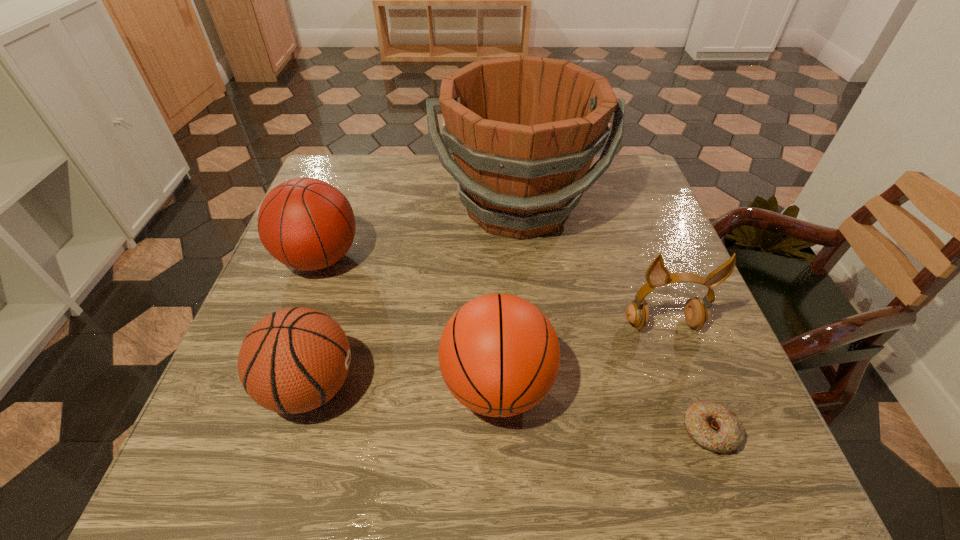
Image resolution: width=960 pixels, height=540 pixels. I want to click on vacant space that satisfies the following two spatial constraints: 1. on the front-facing side of the shortest object; 2. on the left side of the third farthest object, so click(x=702, y=431).